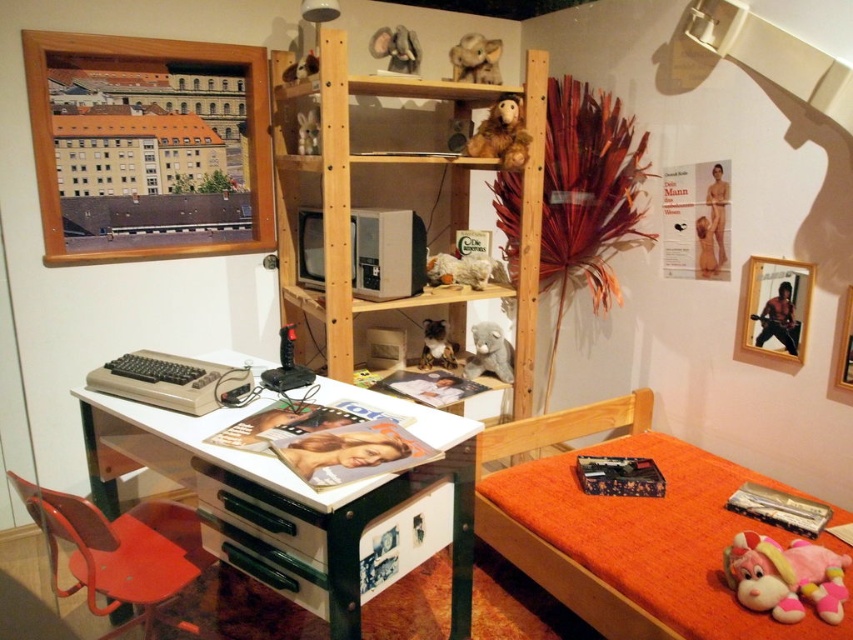
Is point (439, 490) less distant than point (589, 509)?

Yes, it is.

At what (x,y) coordinates should I click in order to perform the action: click on white plastic computer desk at center. Please return your answer as a coordinate pair (x, y). This screenshot has height=640, width=853. Looking at the image, I should click on (300, 502).

The image size is (853, 640). I want to click on white plastic computer desk at center, so click(x=300, y=502).

I want to click on white plastic computer desk at center, so click(x=300, y=502).

How far apart are matte plastic chair at lower left and fuzzy brown elephant at upper center?

matte plastic chair at lower left is 5.93 feet away from fuzzy brown elephant at upper center.

Is point (50, 493) farther from camera compared to point (410, 38)?

No.

Is point (91, 528) closer to camera compared to point (395, 42)?

Yes, it is.

Where is `matte plastic chair at lower left`? matte plastic chair at lower left is located at coordinates (120, 554).

Is point (788, 353) positioned behind point (834, 365)?

Yes, point (788, 353) is farther from viewer.

Is point (791, 330) closer to viewer compared to point (844, 371)?

No, it is behind (844, 371).

The width and height of the screenshot is (853, 640). I want to click on shiny silver picture frame at upper right, so click(x=776, y=307).